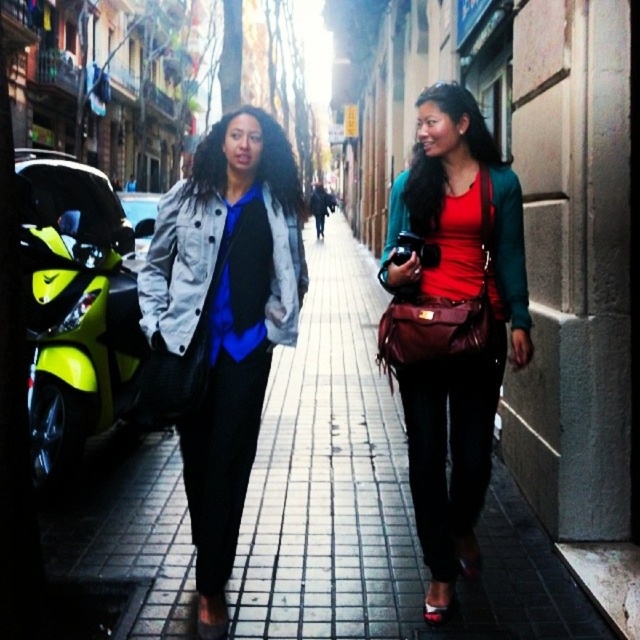
You are a delivery person needing to load a large package onto the neon yellow plastic motorcycle at left. You see the matte red leather bag at center nearby. Can the package fit on the motorcycle if the bag is placed there?

The matte red leather bag at center is smaller than the neon yellow plastic motorcycle at left, so there should be enough space to place the large package on the motorcycle.

You are a delivery person trying to deliver a package to the matte black jacket at center. You have a neon yellow plastic motorcycle at left nearby. Can you determine which object is larger based on their sizes?

The matte black jacket at center is bigger than the neon yellow plastic motorcycle at left, so the matte black jacket at center is larger.

You are a delivery person who needs to pick up a matte red leather bag at center from the sidewalk. There is a neon yellow plastic motorcycle at left blocking the path. Can you reach the bag without moving the motorcycle?

The matte red leather bag at center is closer to the viewer than the neon yellow plastic motorcycle at left, so you can reach the bag without moving the motorcycle because it is in front of the motorcycle.